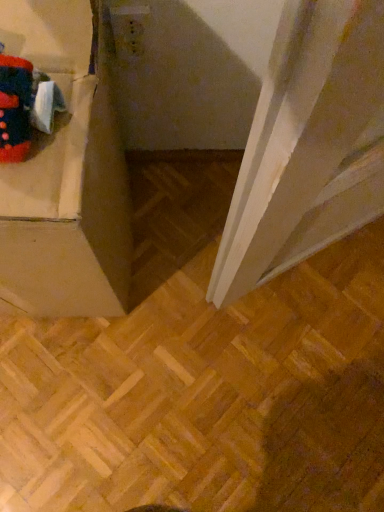
The image size is (384, 512). Find the location of `cardboard box at left`. cardboard box at left is located at coordinates (66, 175).

Describe the element at coordinates (66, 175) in the screenshot. The height and width of the screenshot is (512, 384). I see `cardboard box at left` at that location.

This screenshot has width=384, height=512. Identify the location of cardboard box at left. (66, 175).